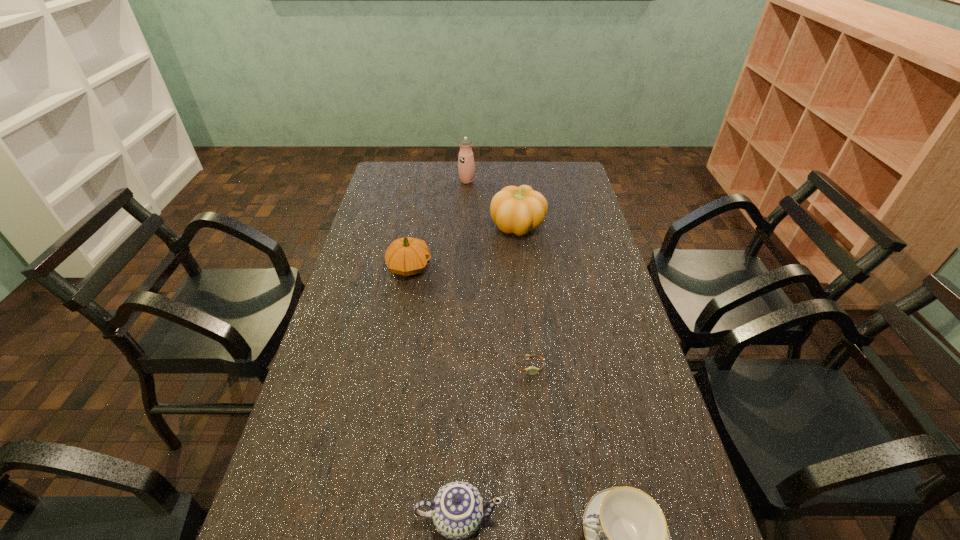
Locate an element on the screen. The image size is (960, 540). empty location between the fourth farthest object and the fifth nearest object is located at coordinates (523, 296).

The height and width of the screenshot is (540, 960). I want to click on free area in between the third nearest object and the pumpkin, so click(523, 296).

The image size is (960, 540). In order to click on the closest object to the pumpkin in this screenshot , I will do `click(466, 166)`.

Find the location of `the closest object to the pumpkin`. the closest object to the pumpkin is located at coordinates (466, 166).